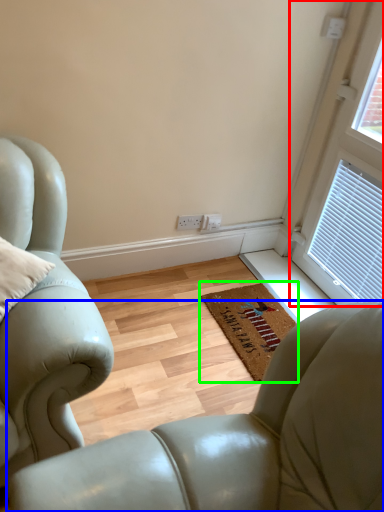
Question: Which object is the closest to the window (highlighted by a red box)? Choose among these: chair (highlighted by a blue box) or mat (highlighted by a green box).

Choices:
 (A) chair
 (B) mat

Answer: (B)